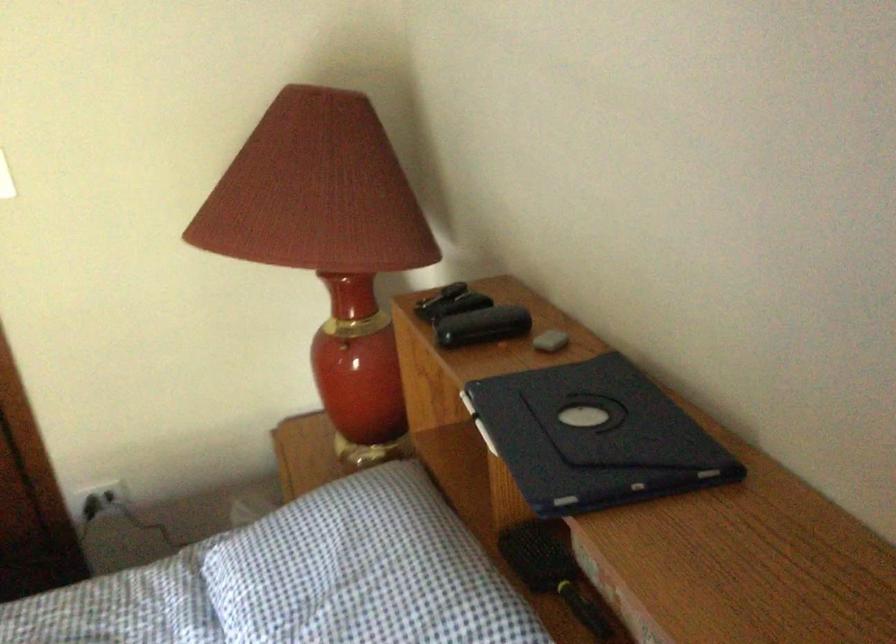
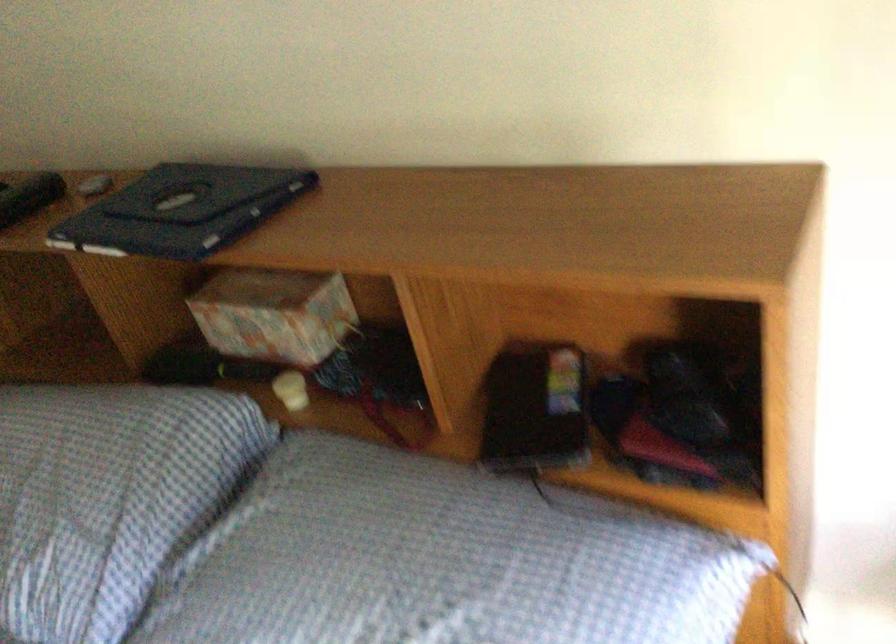
Question: How did the camera likely rotate?

Choices:
 (A) Left
 (B) Right
 (C) Up
 (D) Down

Answer: (B)